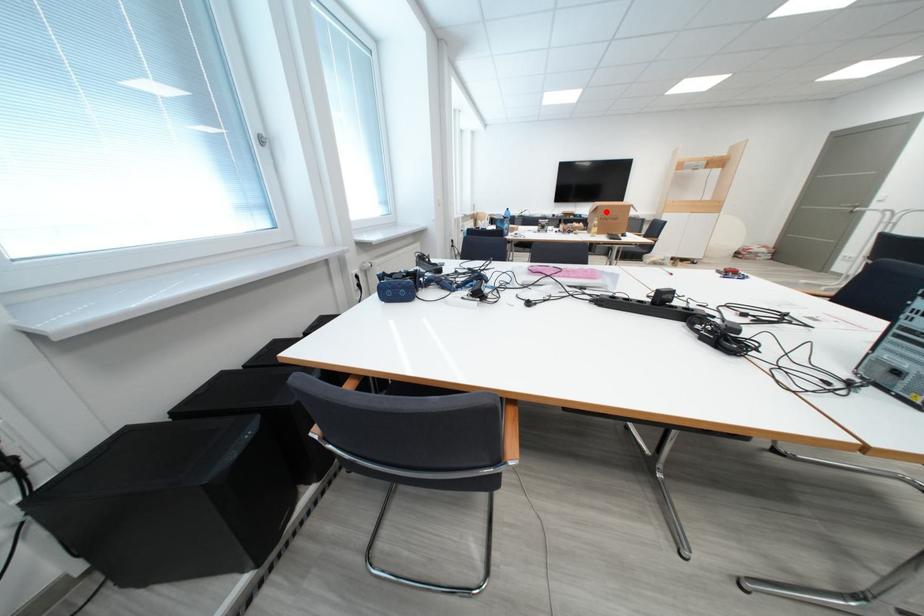
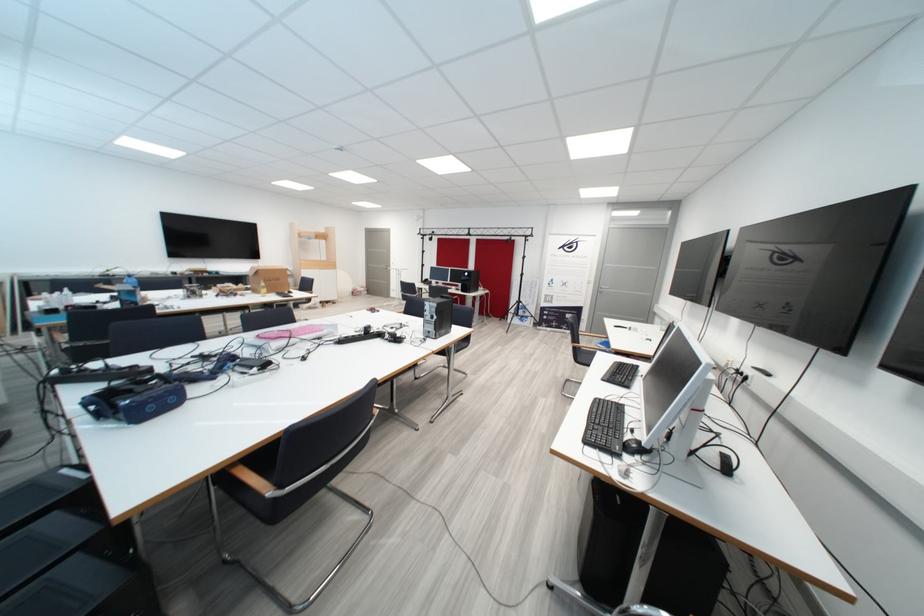
Locate, in the second image, the point that corresponds to the highlighted location in the first image.

(268, 275)